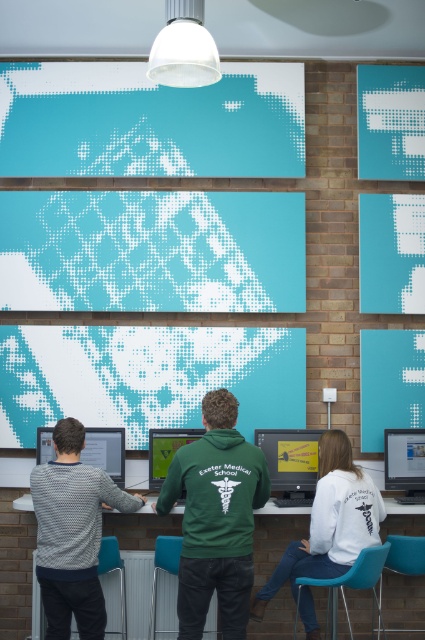
Question: Which is nearer to the white fleece jacket at center?

Choices:
 (A) green fleece jacket at center
 (B) matte yellow monitor at center
 (C) wooden table at center

Answer: (B)

Question: Among these points, which one is nearest to the camera?

Choices:
 (A) (44, 433)
 (B) (385, 483)

Answer: (A)

Question: Where is wooden table at center located in relation to patterned sweater at left in the image?

Choices:
 (A) above
 (B) below

Answer: (B)

Question: Considering the real-world distances, which object is farthest from the white fleece jacket at center?

Choices:
 (A) wooden table at center
 (B) patterned sweater at left

Answer: (B)

Question: Is patterned sweater at left further to camera compared to white fleece jacket at center?

Choices:
 (A) no
 (B) yes

Answer: (A)

Question: Can you confirm if wooden table at center is wider than matte black monitor at lower left?

Choices:
 (A) no
 (B) yes

Answer: (B)